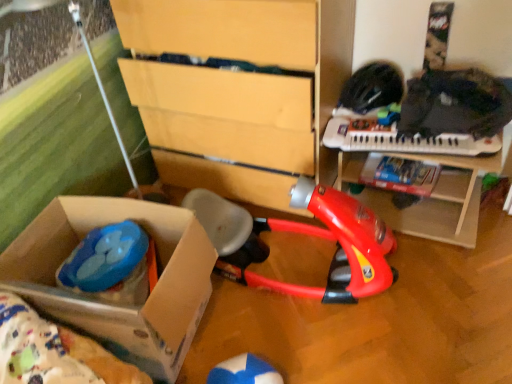
Image resolution: width=512 pixels, height=384 pixels. In order to click on free space above white plastic keyboard at upper right (from a real-world perspective) in this screenshot , I will do `click(399, 132)`.